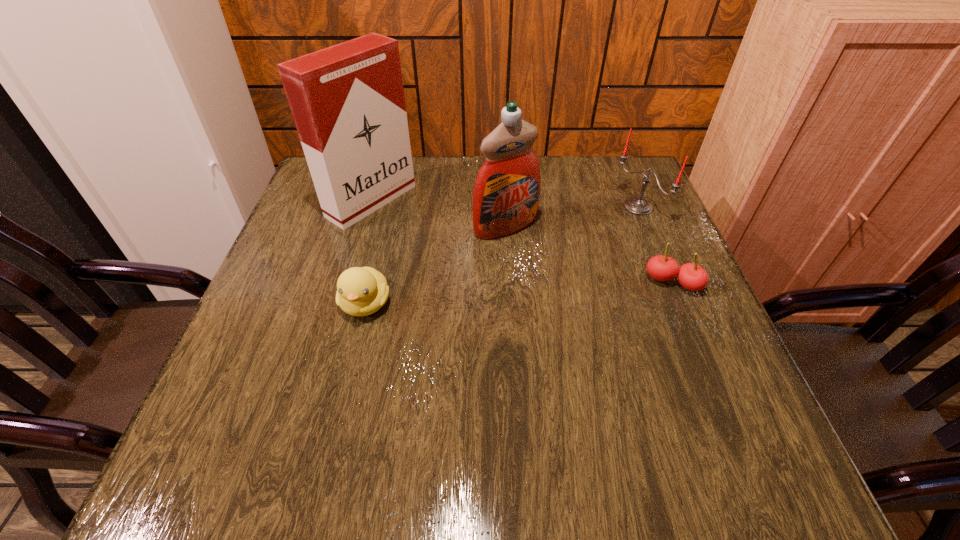
Where is `free space on the desktop that is between the duckling and the cherry and is positioned on the front-facing side of the tallest object`? Image resolution: width=960 pixels, height=540 pixels. free space on the desktop that is between the duckling and the cherry and is positioned on the front-facing side of the tallest object is located at coordinates (528, 293).

Where is `vacant space on the desktop that is between the duckling and the cherry and is positioned on the front surface of the detergent`? vacant space on the desktop that is between the duckling and the cherry and is positioned on the front surface of the detergent is located at coordinates (566, 290).

Locate an element on the screen. Image resolution: width=960 pixels, height=540 pixels. vacant spot on the desktop that is between the duckling and the cherry and is positioned on the front-facing side of the candle is located at coordinates (486, 295).